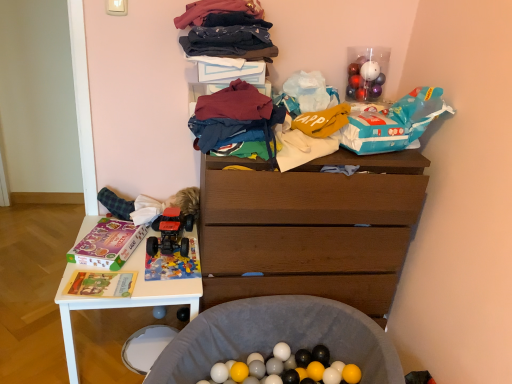
Question: Is soft gray fabric ball pit at lower center, the 2th waste positioned from the top, taller than dark blue cotton socks at upper center, positioned as the first clothing in top-to-bottom order?

Choices:
 (A) no
 (B) yes

Answer: (B)

Question: From the image's perspective, is soft gray fabric ball pit at lower center, which is counted as the 1th waste, starting from the bottom, beneath dark blue cotton socks at upper center, positioned as the first clothing in top-to-bottom order?

Choices:
 (A) no
 (B) yes

Answer: (B)

Question: Is soft gray fabric ball pit at lower center, the 2th waste positioned from the top, bigger than dark blue cotton socks at upper center, marked as the second clothing in a bottom-to-top arrangement?

Choices:
 (A) no
 (B) yes

Answer: (B)

Question: Can you confirm if soft gray fabric ball pit at lower center, the 2th waste positioned from the top, is positioned to the right of dark blue cotton socks at upper center, marked as the second clothing in a bottom-to-top arrangement?

Choices:
 (A) no
 (B) yes

Answer: (B)

Question: From a real-world perspective, is soft gray fabric ball pit at lower center, which is counted as the 1th waste, starting from the bottom, physically above dark blue cotton socks at upper center, positioned as the first clothing in top-to-bottom order?

Choices:
 (A) no
 (B) yes

Answer: (A)

Question: From the image's perspective, is maroon fabric at center, acting as the first clothing starting from the bottom, positioned above or below blue plastic bag at upper right, which is counted as the second waste, starting from the bottom?

Choices:
 (A) below
 (B) above

Answer: (A)

Question: Considering the relative positions of maroon fabric at center, acting as the first clothing starting from the bottom, and blue plastic bag at upper right, which is counted as the second waste, starting from the bottom, in the image provided, is maroon fabric at center, acting as the first clothing starting from the bottom, to the left or to the right of blue plastic bag at upper right, which is counted as the second waste, starting from the bottom,?

Choices:
 (A) left
 (B) right

Answer: (A)

Question: Relative to blue plastic bag at upper right, the first waste viewed from the top, is maroon fabric at center, acting as the first clothing starting from the bottom, in front or behind?

Choices:
 (A) front
 (B) behind

Answer: (A)

Question: Looking at the image, does maroon fabric at center, acting as the first clothing starting from the bottom, seem bigger or smaller compared to blue plastic bag at upper right, which is counted as the second waste, starting from the bottom?

Choices:
 (A) big
 (B) small

Answer: (B)

Question: From a real-world perspective, is soft gray fabric ball pit at lower center, the 2th waste positioned from the top, physically located above or below soft cotton clothes at upper center?

Choices:
 (A) below
 (B) above

Answer: (A)

Question: Visually, is soft gray fabric ball pit at lower center, which is counted as the 1th waste, starting from the bottom, positioned to the left or to the right of soft cotton clothes at upper center?

Choices:
 (A) right
 (B) left

Answer: (A)

Question: From the image's perspective, is soft gray fabric ball pit at lower center, which is counted as the 1th waste, starting from the bottom, positioned above or below soft cotton clothes at upper center?

Choices:
 (A) below
 (B) above

Answer: (A)

Question: In terms of width, does soft gray fabric ball pit at lower center, the 2th waste positioned from the top, look wider or thinner when compared to soft cotton clothes at upper center?

Choices:
 (A) thin
 (B) wide

Answer: (B)

Question: Looking at their shapes, would you say soft cotton clothes at upper center is wider or thinner than fluffy green fabric at left?

Choices:
 (A) thin
 (B) wide

Answer: (B)

Question: Would you say soft cotton clothes at upper center is inside or outside fluffy green fabric at left?

Choices:
 (A) outside
 (B) inside

Answer: (A)